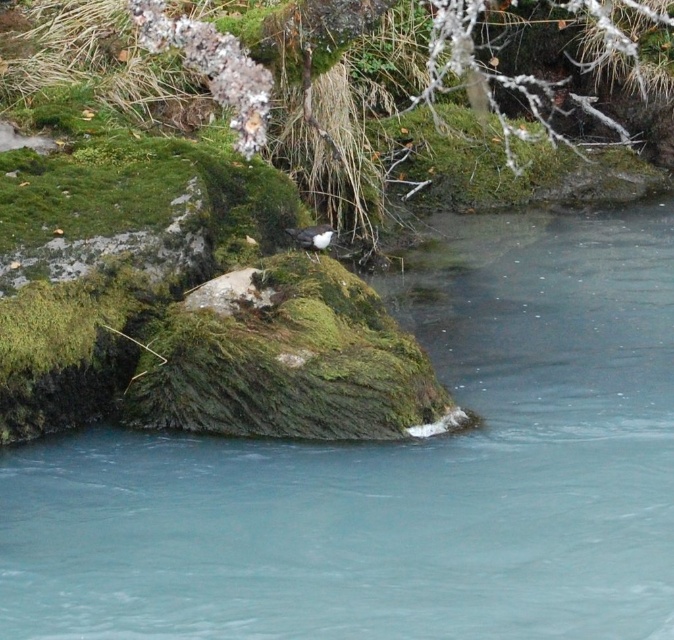
Question: Can you confirm if clear blue water at center is positioned below green mossy rock at center?

Choices:
 (A) yes
 (B) no

Answer: (A)

Question: Which point is farther to the camera?

Choices:
 (A) green mossy rock at center
 (B) clear blue water at center

Answer: (A)

Question: Does clear blue water at center have a lesser width compared to green mossy rock at center?

Choices:
 (A) yes
 (B) no

Answer: (B)

Question: Is clear blue water at center wider than green mossy rock at center?

Choices:
 (A) yes
 (B) no

Answer: (A)